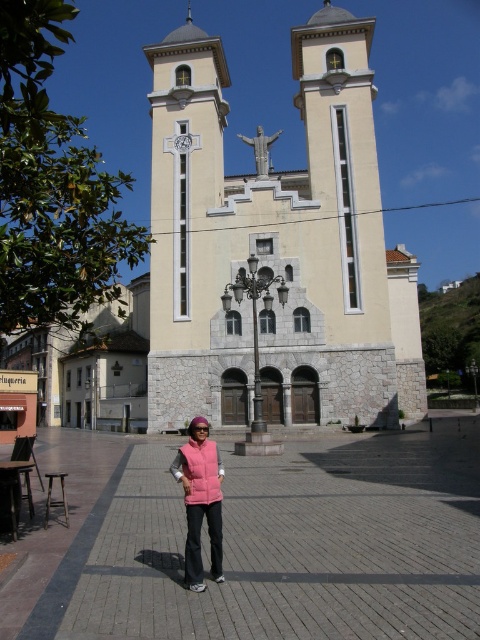
You are standing in the plaza in front of the beige stone church at center and the pink fleece vest at center. Which object is closer to you?

The pink fleece vest at center is closer to you because the beige stone church at center is positioned over it, indicating the vest is in front.

You are standing at the center of the paved square in front of the church. You want to walk to the point marked by point (408,339) and then to point (206,476). Which point should you visit first to follow the correct path?

You should visit point (206,476) first because point (408,339) is behind it, so you need to go to the closer point first before moving to the one behind.

You are standing in the plaza in front of the beige stone church at center and the pink quilted vest at center. Which object is positioned higher relative to the ground?

The beige stone church at center is located above the pink quilted vest at center, so it is positioned higher relative to the ground.